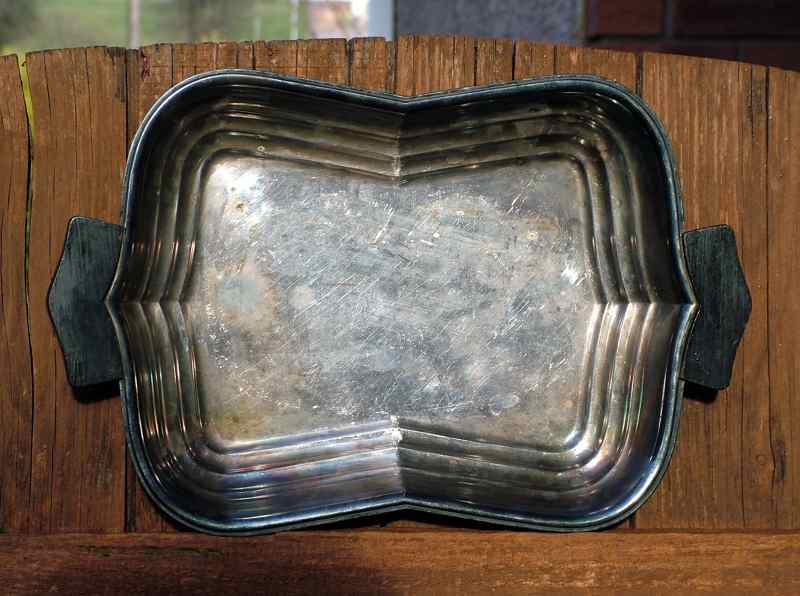
Find the location of a particular element. plate is located at coordinates (358, 375).